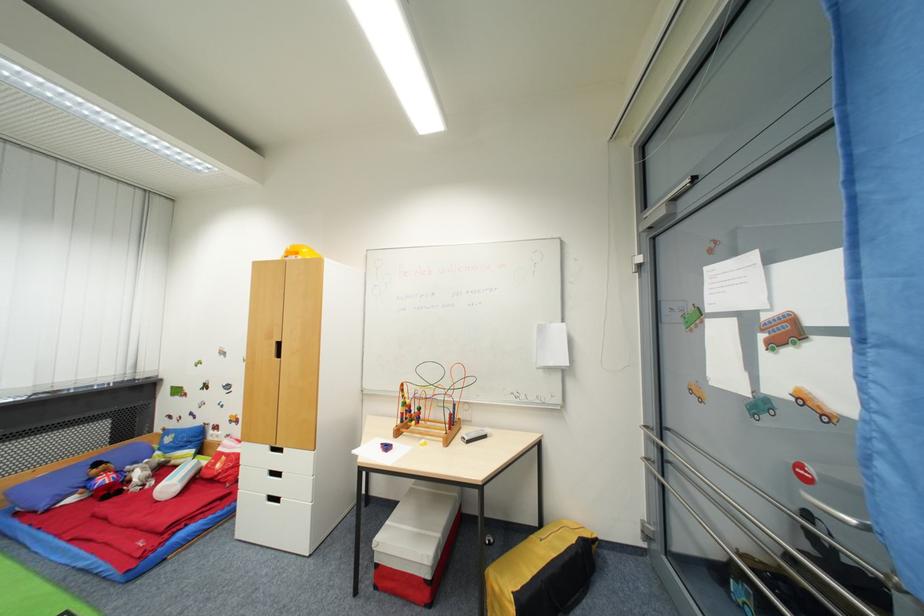
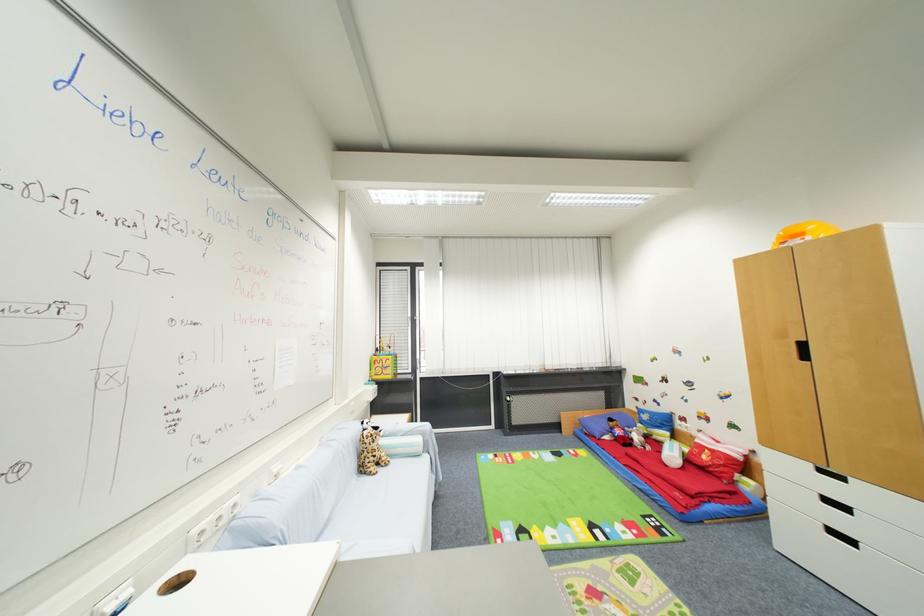
Where in the second image is the point corresponding to point (273, 448) from the first image?

(816, 467)